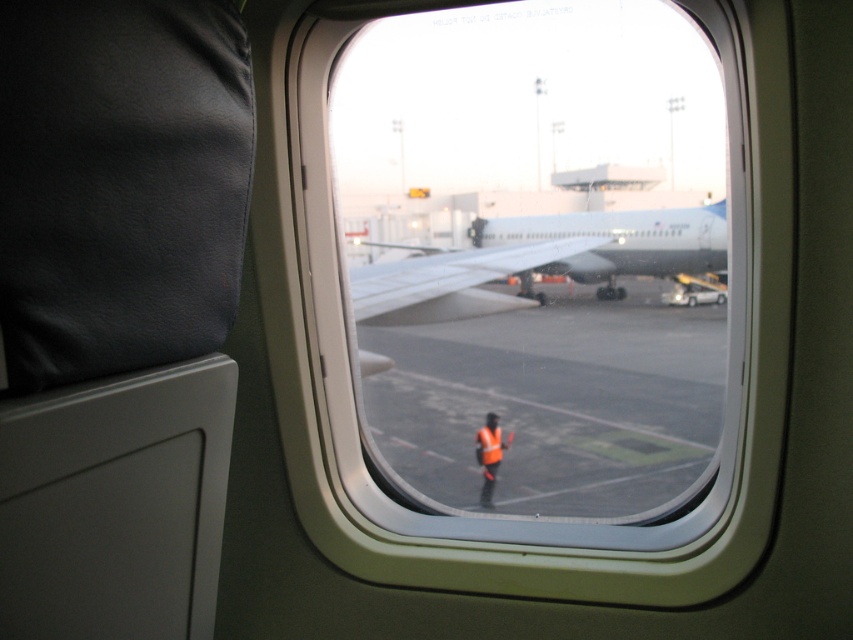
Question: Which object appears farthest from the camera in this image?

Choices:
 (A) reflective orange vest at center
 (B) transparent glass airplane window at center
 (C) reflective orange safety vest at center

Answer: (C)

Question: Is white matte airplane at center positioned before reflective orange safety vest at center?

Choices:
 (A) no
 (B) yes

Answer: (B)

Question: Which point is farther to the camera?

Choices:
 (A) (486, 422)
 (B) (596, 490)
 (C) (352, 19)
 (D) (619, 243)

Answer: (A)

Question: Is transparent glass airplane window at center behind reflective orange vest at center?

Choices:
 (A) yes
 (B) no

Answer: (B)

Question: Which object is the closest to the reflective orange vest at center?

Choices:
 (A) smooth asphalt runway at center
 (B) transparent glass airplane window at center
 (C) white matte airplane at center
 (D) reflective orange safety vest at center

Answer: (D)

Question: Can you confirm if white matte airplane at center is thinner than reflective orange safety vest at center?

Choices:
 (A) yes
 (B) no

Answer: (B)